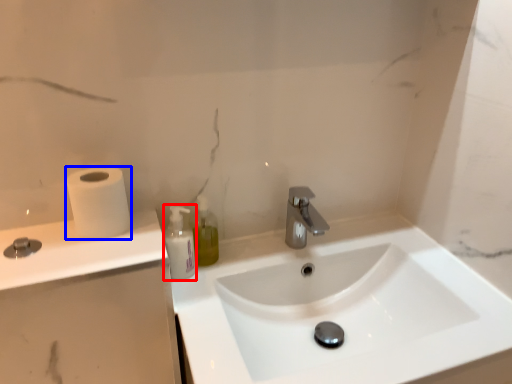
Question: Which point is closer to the camera, mouthwash (highlighted by a red box) or toilet paper (highlighted by a blue box)?

Choices:
 (A) mouthwash
 (B) toilet paper

Answer: (B)